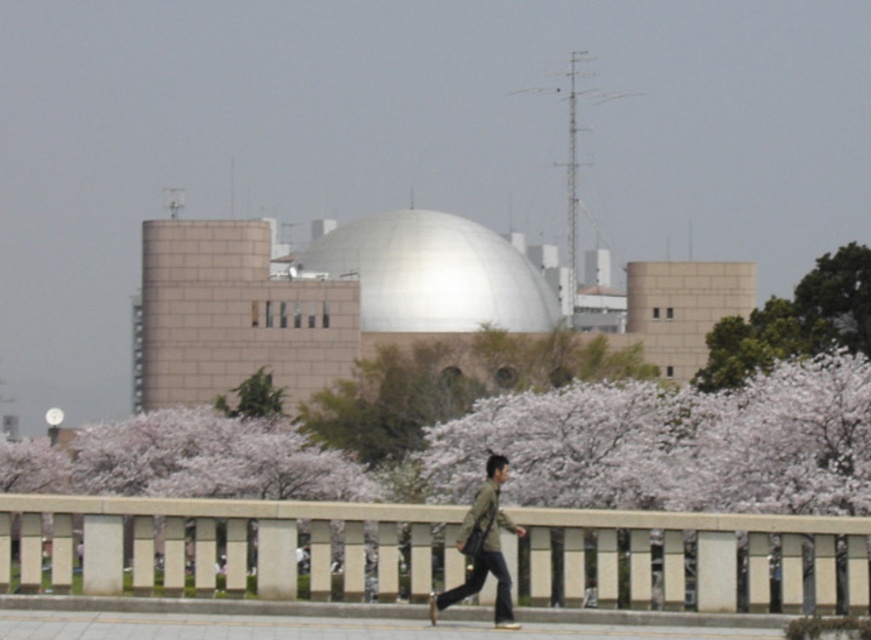
Question: Which object is farther from the camera taking this photo?

Choices:
 (A) green matte jacket at center
 (B) white smooth dome at center
 (C) green leafy tree at upper right

Answer: (B)

Question: Which of these objects is positioned farthest from the green matte jacket at center?

Choices:
 (A) white smooth dome at center
 (B) beige concrete rail at center
 (C) green leafy tree at upper right

Answer: (A)

Question: Which of the following is the farthest from the observer?

Choices:
 (A) (866, 284)
 (B) (692, 561)
 (C) (491, 316)
 (D) (497, 556)

Answer: (C)

Question: Is green leafy tree at upper right to the left of green matte jacket at center from the viewer's perspective?

Choices:
 (A) yes
 (B) no

Answer: (B)

Question: Does white smooth dome at center come behind green leafy tree at upper right?

Choices:
 (A) no
 (B) yes

Answer: (B)

Question: Is white smooth dome at center smaller than green matte jacket at center?

Choices:
 (A) no
 (B) yes

Answer: (A)